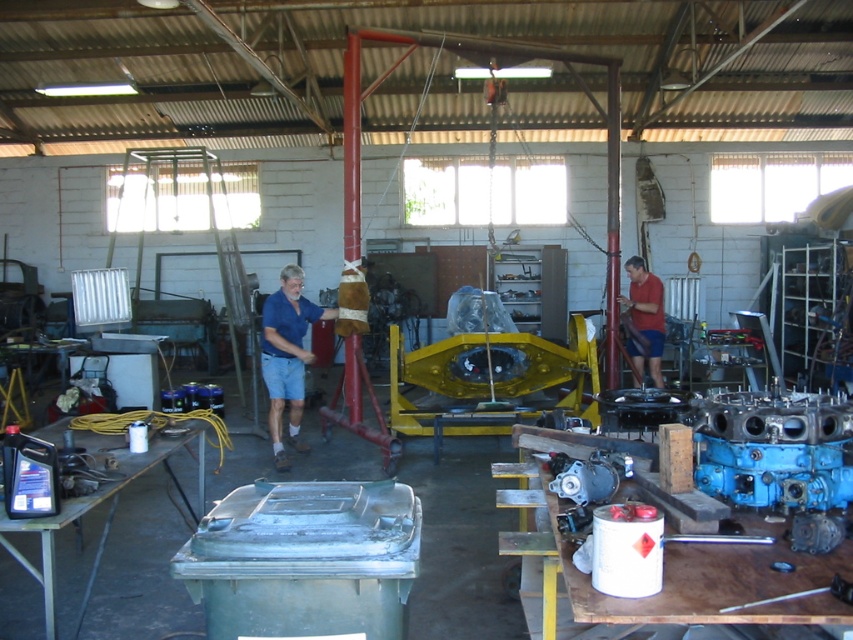
You are a safety inspector in the workshop. You need to ensure that all workers are wearing proper safety gear. You notice the blue fabric shirt at center and the red matte shirt at center. Which worker is taller?

The blue fabric shirt at center has a greater height compared to the red matte shirt at center, so the worker wearing the blue fabric shirt at center is taller.